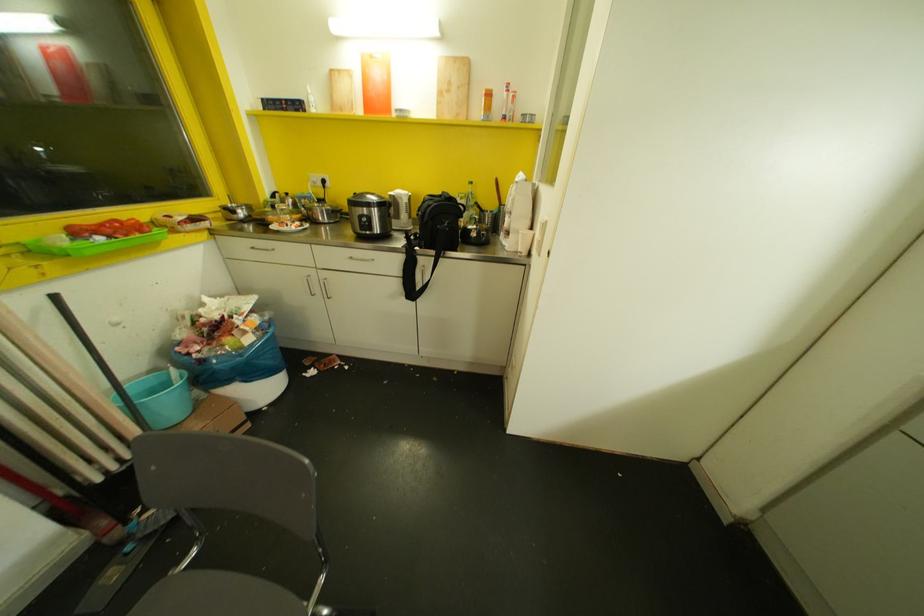
Image resolution: width=924 pixels, height=616 pixels. Identify the location of chair sitting surface. (216, 596).